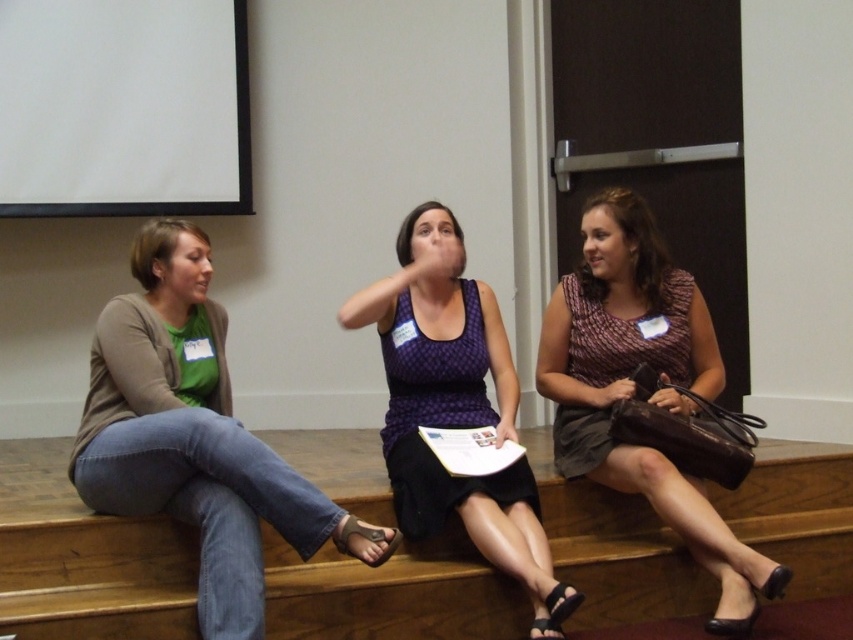
You are a maintenance worker needing to reach the white matte projection screen at upper left from the brown wooden stairs at center. The ladder you have is 2 meters long. Will the ladder be sufficient to bridge the gap between them?

The brown wooden stairs at center and white matte projection screen at upper left are 1.97 meters apart. Since the ladder is 2 meters long, it will be sufficient to bridge the gap between them.

Looking at this image, you are organizing a photoshoot in this conference room and need to position a large camera tripod between the two people wearing the matte brown dress at right and the purple dotted tank top at center. Based on their positions, is there enough space to place the tripod between them?

The matte brown dress at right is to the right of the purple dotted tank top at center, so there is space between them to place the tripod.

You are standing in the conference room and want to walk up the brown wooden stairs at center to reach the white matte projection screen at upper left. Is the stairs accessible from your current position?

The brown wooden stairs at center is closer to the viewer than white matte projection screen at upper left, so yes, the stairs are accessible from your current position as they are in front of the screen.